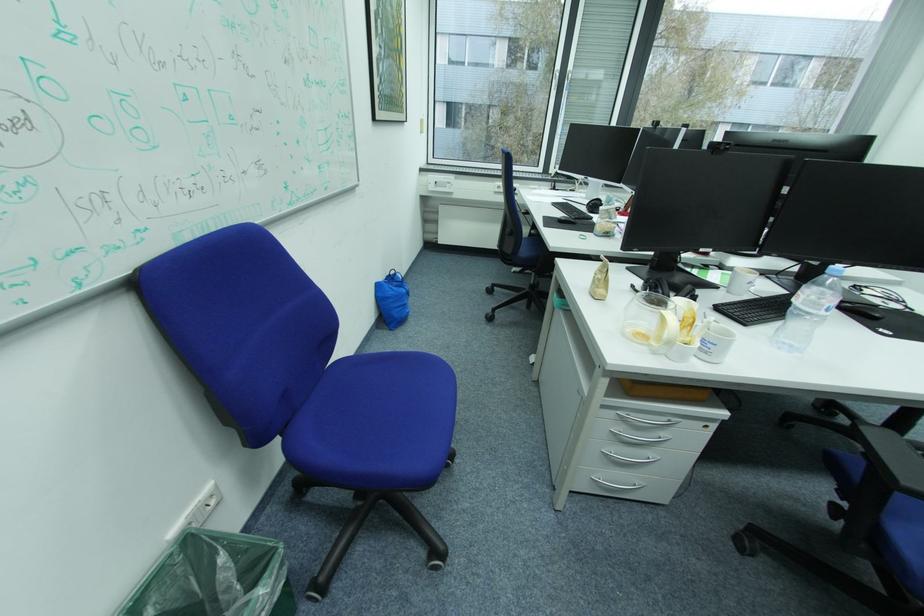
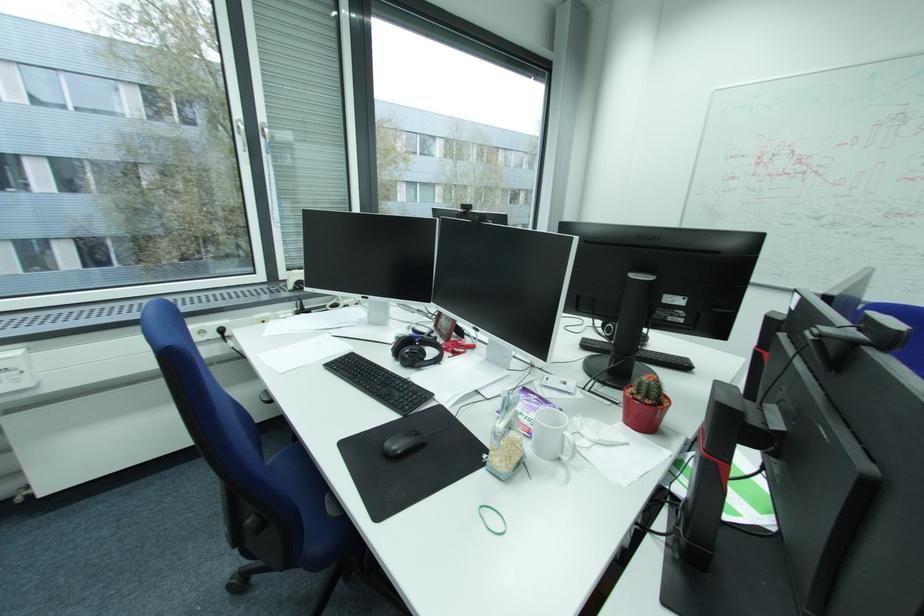
In the second image, find the point that corresponds to (566,204) in the first image.

(345, 361)